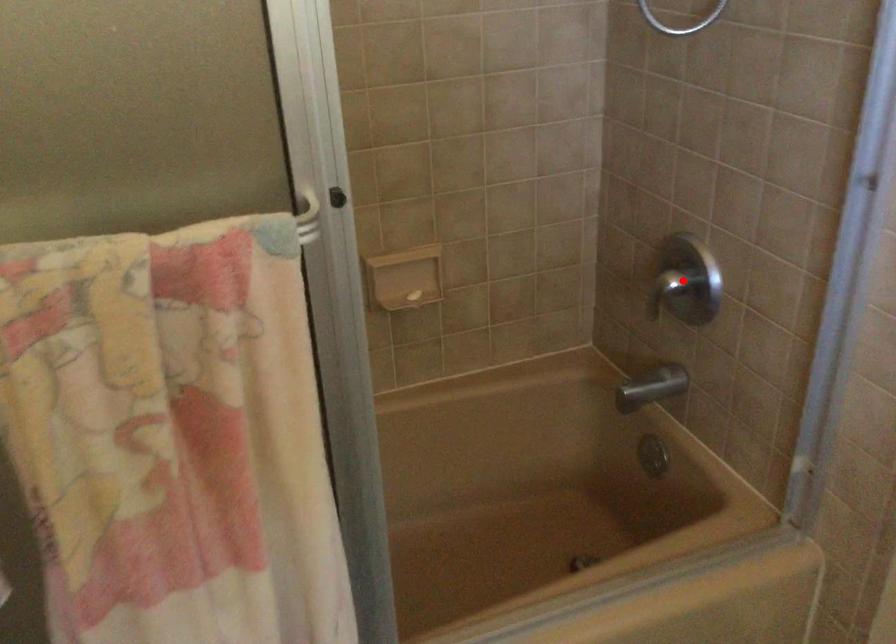
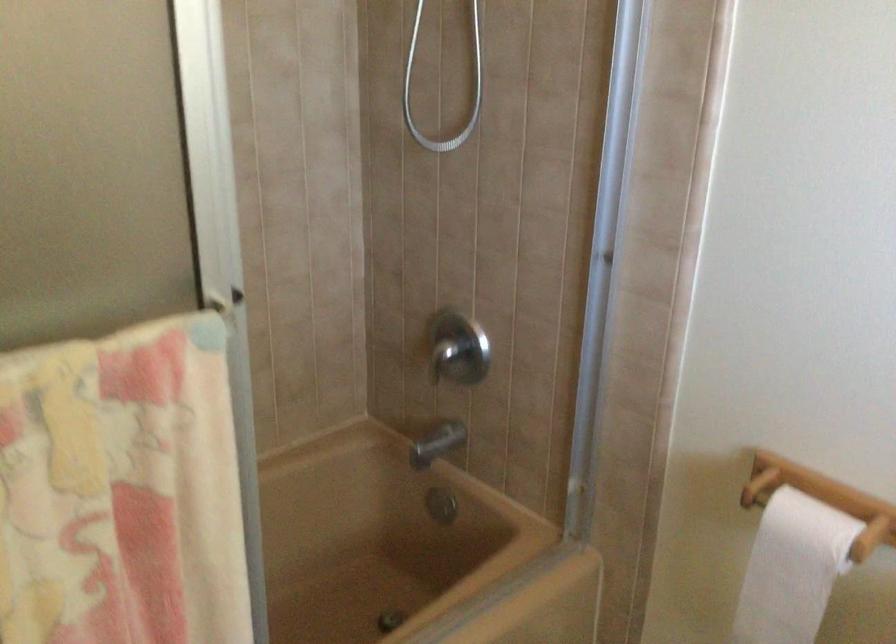
In the second image, find the point that corresponds to the highlighted location in the first image.

(458, 348)